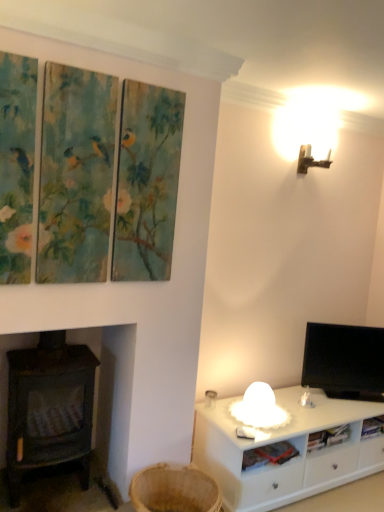
Locate an element on the screen. free space above white plastic shelf at lower right (from a real-world perspective) is located at coordinates (271, 453).